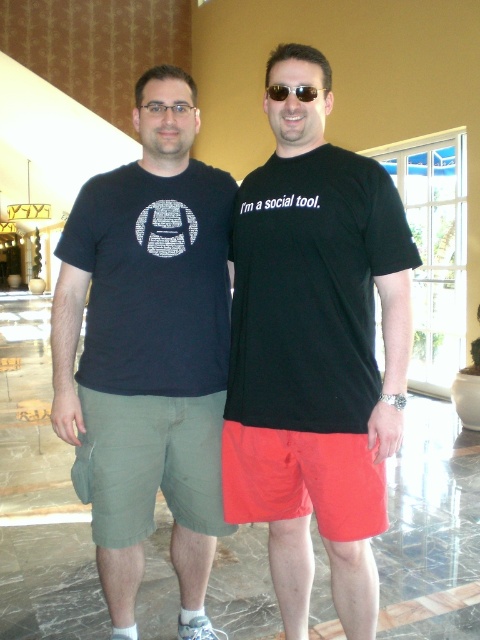
Looking at this image, can you confirm if black cotton t-shirt at center is positioned to the right of sunglasses at center?

In fact, black cotton t-shirt at center is to the left of sunglasses at center.

Which is in front, point (178, 426) or point (277, 86)?

Point (277, 86) is more forward.

At what (x,y) coordinates should I click in order to perform the action: click on black cotton t-shirt at center. Please return your answer as a coordinate pair (x, y). Image resolution: width=480 pixels, height=640 pixels. Looking at the image, I should click on (147, 349).

Is black matte t-shirt at center wider than black cotton t-shirt at center?

No.

Which is below, black matte t-shirt at center or black cotton t-shirt at center?

Positioned lower is black cotton t-shirt at center.

Who is more forward, (x=254, y=180) or (x=176, y=170)?

Point (x=254, y=180) is more forward.

The image size is (480, 640). I want to click on black matte t-shirt at center, so click(315, 352).

Does black matte t-shirt at center appear on the left side of sunglasses at center?

Incorrect, black matte t-shirt at center is not on the left side of sunglasses at center.

Who is lower down, black matte t-shirt at center or sunglasses at center?

black matte t-shirt at center

What are the coordinates of `black matte t-shirt at center` in the screenshot? It's located at (315, 352).